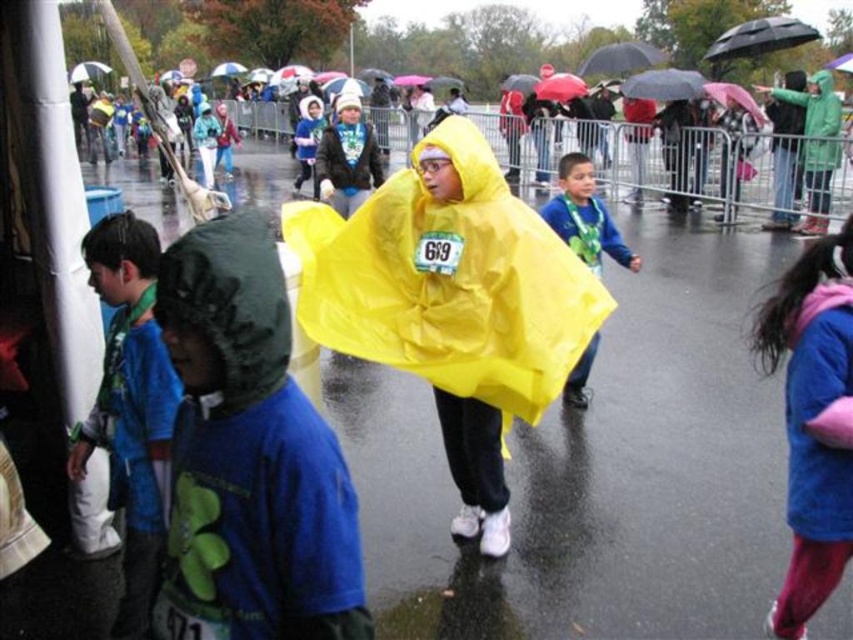
Does blue cotton shirt at left have a lesser height compared to matte yellow raincoat at center?

No.

You are a GUI agent. You are given a task and a screenshot of the screen. Output one action in this format:
    pyautogui.click(x=<x>, y=<y>)
    Task: Click on the blue cotton shirt at left
    The image size is (853, 640).
    Given the screenshot: What is the action you would take?
    pyautogui.click(x=131, y=406)

At what (x,y) coordinates should I click in order to perform the action: click on blue cotton shirt at left. Please return your answer as a coordinate pair (x, y). The width and height of the screenshot is (853, 640). Looking at the image, I should click on (131, 406).